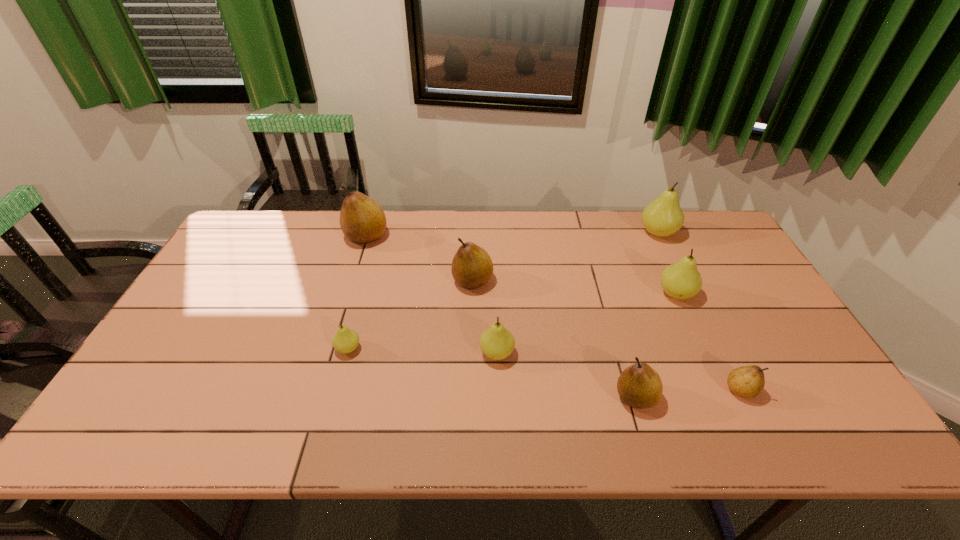
At what (x,y) coordinates should I click in order to perform the action: click on the rightmost brown pear. Please return your answer as a coordinate pair (x, y). This screenshot has width=960, height=540. Looking at the image, I should click on (747, 381).

Find the location of a particular element. vacant space situated 0.100m on the right of the farthest brown pear is located at coordinates (418, 237).

Locate an element on the screen. blank area located 0.120m on the left of the biggest green pear is located at coordinates (603, 233).

Where is `blank area located on the left of the third nearest green pear`? This screenshot has height=540, width=960. blank area located on the left of the third nearest green pear is located at coordinates (615, 294).

I want to click on vacant space located on the back of the second biggest brown pear, so click(473, 246).

Locate an element on the screen. This screenshot has width=960, height=540. vacant space situated 0.130m on the back of the second green pear from left to right is located at coordinates (495, 304).

Locate an element on the screen. The image size is (960, 540). free region located on the left of the third biggest brown pear is located at coordinates (445, 397).

Identify the location of vacant space located 0.380m on the right of the smallest green pear. (507, 348).

Locate an element on the screen. The width and height of the screenshot is (960, 540). vacant space located 0.340m on the left of the rightmost brown pear is located at coordinates (584, 390).

At what (x,y) coordinates should I click in order to perform the action: click on object present at the near edge. Please return your answer as a coordinate pair (x, y). Looking at the image, I should click on (639, 386).